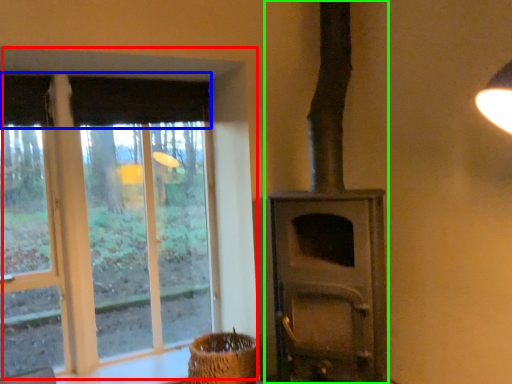
Question: Estimate the real-world distances between objects in this image. Which object is farther from window (highlighted by a red box), curtain (highlighted by a blue box) or wood burning stove (highlighted by a green box)?

Choices:
 (A) curtain
 (B) wood burning stove

Answer: (B)